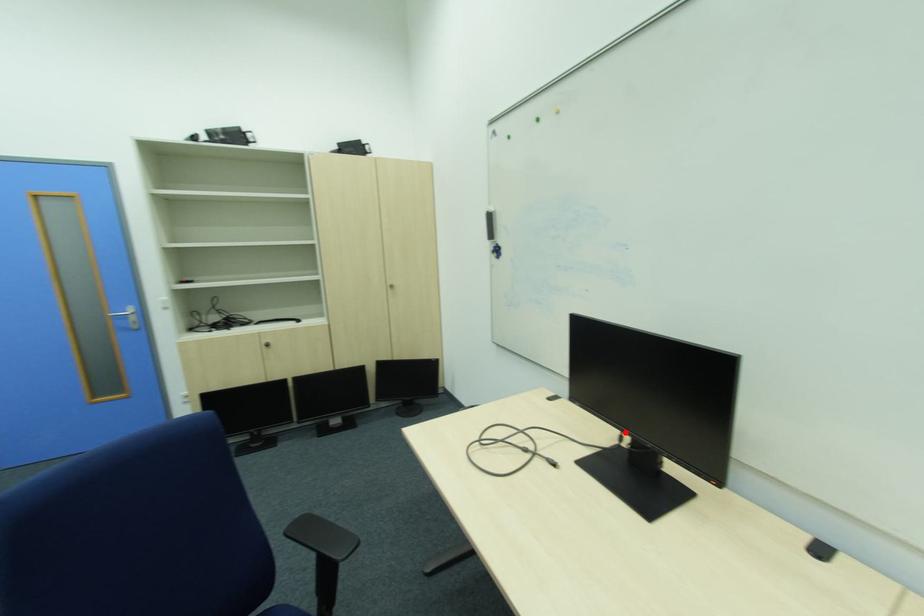
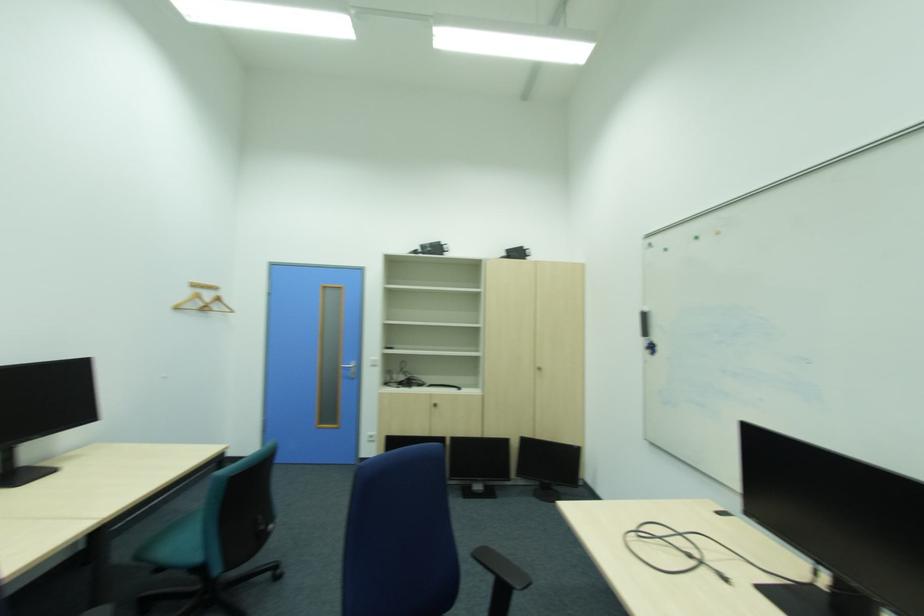
Question: I am providing you with two images of the same scene from different viewpoints. A red point is marked on the first image. Is the red point's position out of view in image 2?

Choices:
 (A) Yes
 (B) No

Answer: (B)